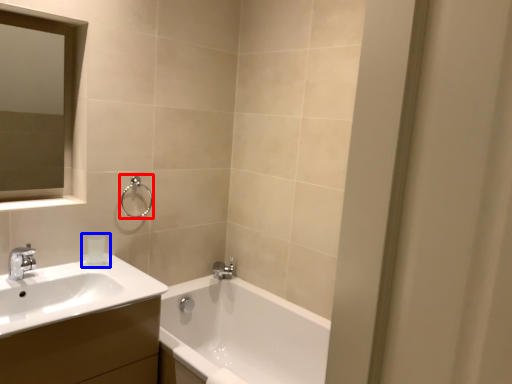
Question: Which of the following is the closest to the observer, shower (highlighted by a red box) or toiletry (highlighted by a blue box)?

Choices:
 (A) shower
 (B) toiletry

Answer: (B)